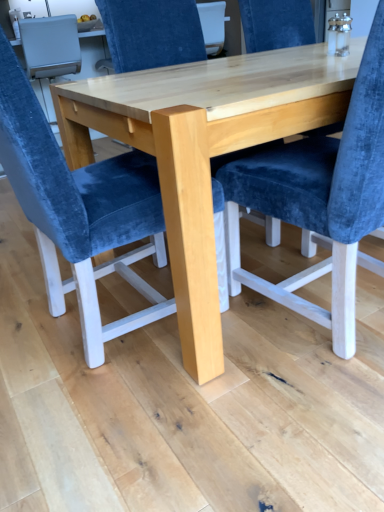
Question: Can you confirm if velvet blue chair at center, the 2th chair viewed from the back, is taller than velvet blue chair at center, the 1th chair in the back-to-front sequence?

Choices:
 (A) no
 (B) yes

Answer: (A)

Question: Can you confirm if velvet blue chair at center, placed as the first chair when sorted from front to back, is shorter than velvet blue chair at center, the 1th chair in the back-to-front sequence?

Choices:
 (A) no
 (B) yes

Answer: (B)

Question: Considering the relative positions of velvet blue chair at center, the 2th chair viewed from the back, and velvet blue chair at center, the 1th chair in the back-to-front sequence, in the image provided, is velvet blue chair at center, the 2th chair viewed from the back, to the left of velvet blue chair at center, the 1th chair in the back-to-front sequence, from the viewer's perspective?

Choices:
 (A) yes
 (B) no

Answer: (A)

Question: Does velvet blue chair at center, the 2th chair viewed from the back, have a greater width compared to velvet blue chair at center, the 1th chair in the back-to-front sequence?

Choices:
 (A) no
 (B) yes

Answer: (A)

Question: Is velvet blue chair at center, placed as the first chair when sorted from front to back, turned away from velvet blue chair at center, the second chair viewed from the front?

Choices:
 (A) yes
 (B) no

Answer: (B)

Question: From a real-world perspective, relative to velvet blue chair at center, the 2th chair viewed from the back, is natural wood table at center vertically above or below?

Choices:
 (A) above
 (B) below

Answer: (B)

Question: From the image's perspective, is natural wood table at center positioned above or below velvet blue chair at center, the 2th chair viewed from the back?

Choices:
 (A) below
 (B) above

Answer: (B)

Question: Considering the positions of point (185, 94) and point (124, 223), is point (185, 94) closer or farther from the camera than point (124, 223)?

Choices:
 (A) closer
 (B) farther

Answer: (A)

Question: Visually, is natural wood table at center positioned to the left or to the right of velvet blue chair at center, the 2th chair viewed from the back?

Choices:
 (A) right
 (B) left

Answer: (A)

Question: Considering their positions, is velvet blue chair at center, the second chair viewed from the front, located in front of or behind velvet blue chair at center, placed as the first chair when sorted from front to back?

Choices:
 (A) front
 (B) behind

Answer: (B)

Question: Considering the positions of velvet blue chair at center, the second chair viewed from the front, and velvet blue chair at center, the 2th chair viewed from the back, in the image, is velvet blue chair at center, the second chair viewed from the front, bigger or smaller than velvet blue chair at center, the 2th chair viewed from the back,?

Choices:
 (A) big
 (B) small

Answer: (A)

Question: Does point (187, 33) appear closer or farther from the camera than point (147, 173)?

Choices:
 (A) closer
 (B) farther

Answer: (B)

Question: In terms of height, does velvet blue chair at center, the 1th chair in the back-to-front sequence, look taller or shorter compared to velvet blue chair at center, the 2th chair viewed from the back?

Choices:
 (A) tall
 (B) short

Answer: (A)

Question: From their relative heights in the image, would you say natural wood table at center is taller or shorter than velvet blue chair at center, the second chair viewed from the front?

Choices:
 (A) short
 (B) tall

Answer: (A)

Question: From the image's perspective, is natural wood table at center located above or below velvet blue chair at center, the 1th chair in the back-to-front sequence?

Choices:
 (A) below
 (B) above

Answer: (A)